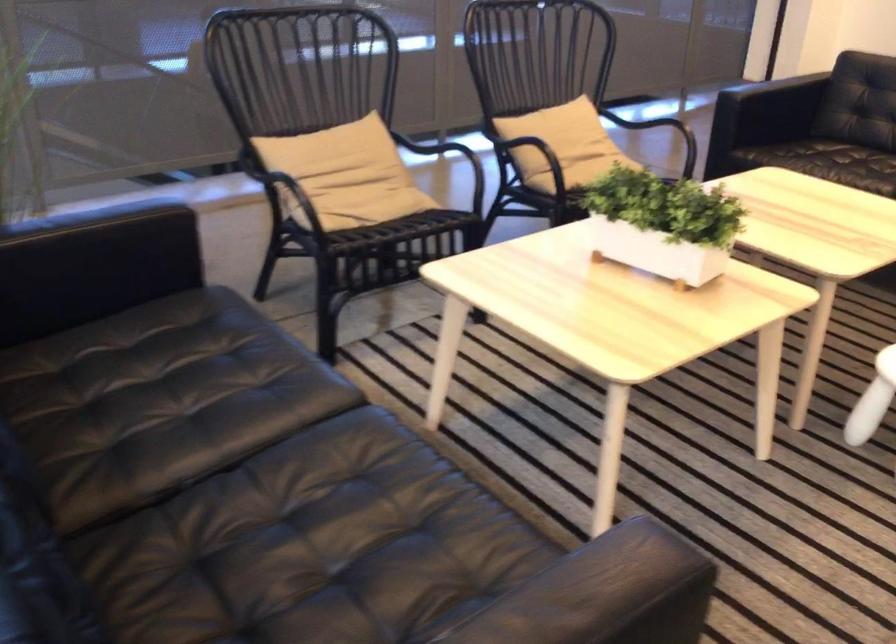
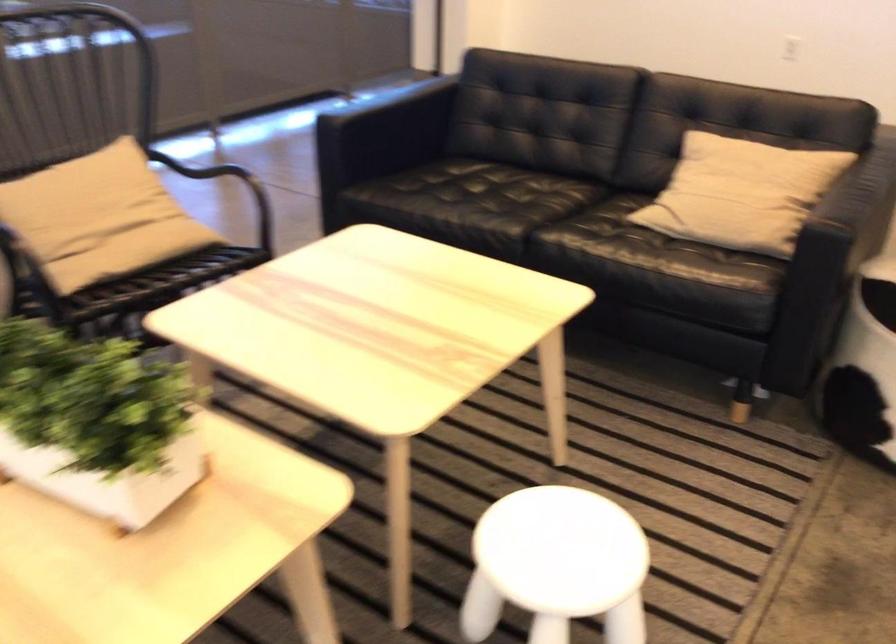
The point at (678, 214) is marked in the first image. Where is the corresponding point in the second image?

(96, 422)